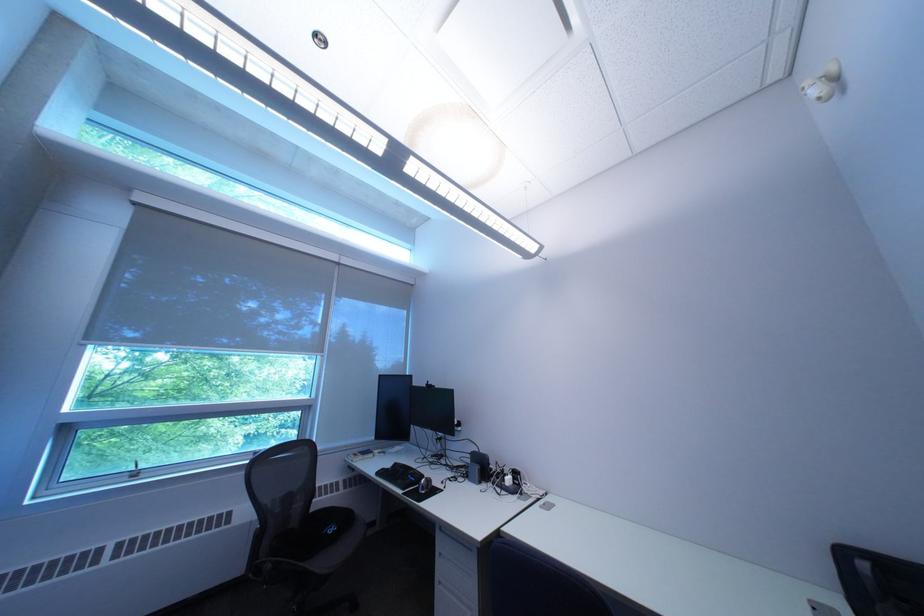
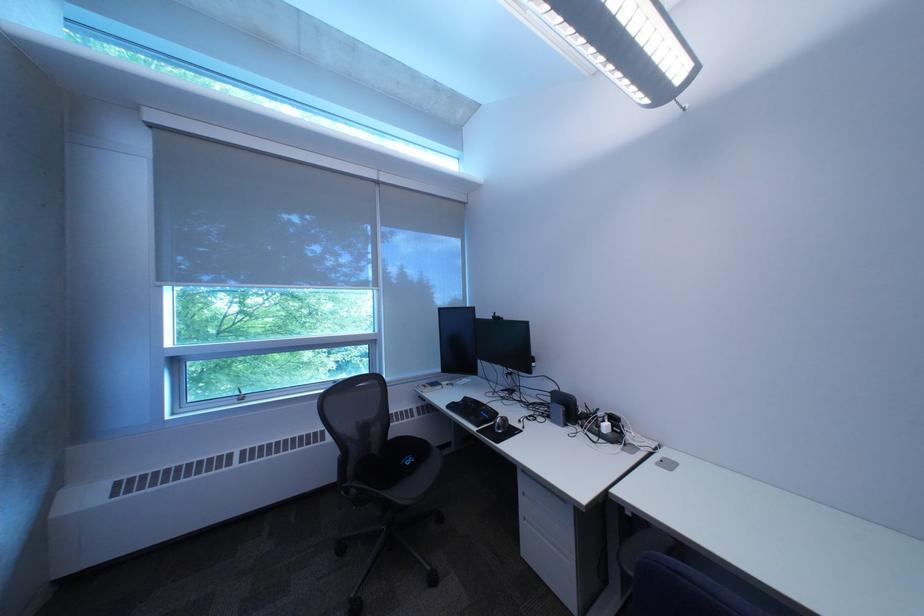
Find the pixel in the second image that matches (x=315, y=413) in the first image.

(383, 347)